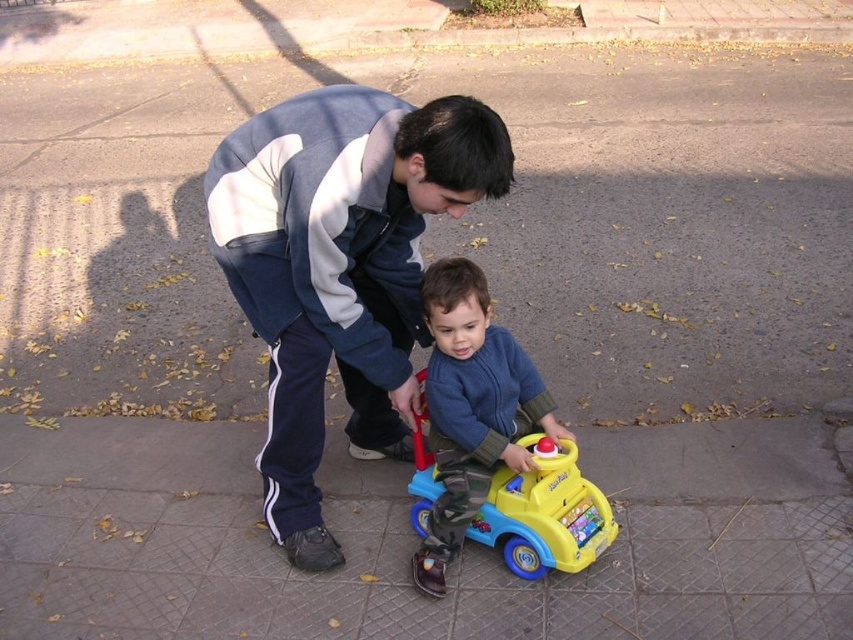
Between dark blue tracksuit at center and blue soft toy car at center, which one has more height?

Standing taller between the two is dark blue tracksuit at center.

Is dark blue tracksuit at center below blue soft toy car at center?

No.

Which is in front, point (390, 147) or point (479, 465)?

Point (390, 147) is more forward.

The width and height of the screenshot is (853, 640). I want to click on dark blue tracksuit at center, so click(x=340, y=268).